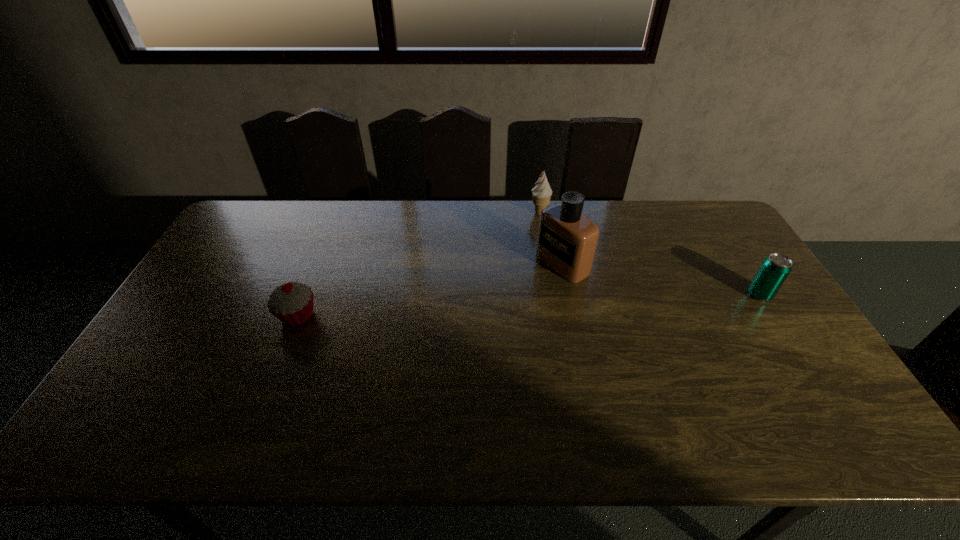
Locate an element on the screen. cupcake is located at coordinates (292, 303).

You are a GUI agent. You are given a task and a screenshot of the screen. Output one action in this format:
    pyautogui.click(x=<x>, y=<y>)
    Task: Click on the rightmost object
    
    Given the screenshot: What is the action you would take?
    pyautogui.click(x=775, y=268)

Where is `the second farthest object`? the second farthest object is located at coordinates (567, 240).

Locate an element on the screen. the tallest object is located at coordinates (567, 240).

Locate an element on the screen. icecream is located at coordinates (542, 192).

You are a GUI agent. You are given a task and a screenshot of the screen. Output one action in this format:
    pyautogui.click(x=<x>, y=<y>)
    Task: Click on the third shortest object
    The height and width of the screenshot is (540, 960).
    Given the screenshot: What is the action you would take?
    pyautogui.click(x=542, y=192)

Locate an element on the screen. This screenshot has width=960, height=540. vacant space located 0.380m on the right of the leftmost object is located at coordinates (452, 316).

Where is `vacant space located on the left of the rightmost object`? The width and height of the screenshot is (960, 540). vacant space located on the left of the rightmost object is located at coordinates (613, 294).

I want to click on vacant area situated 0.360m on the front label of the perfume, so click(x=449, y=331).

I want to click on vacant region located 0.230m on the front label of the perfume, so click(486, 309).